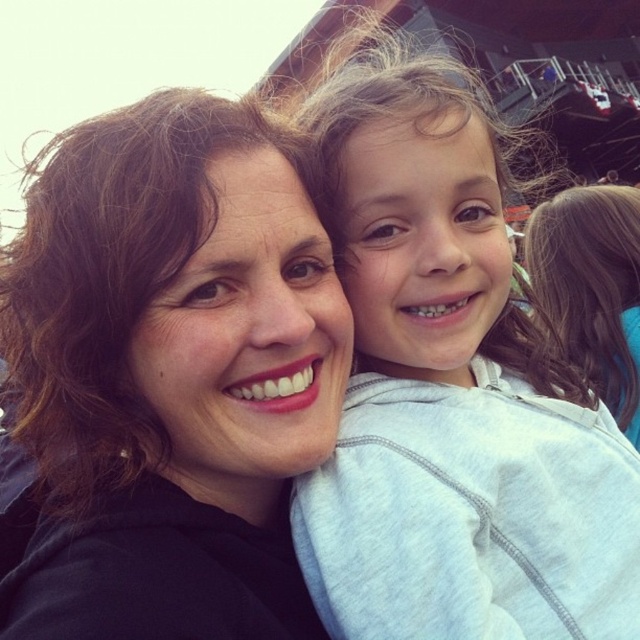
Which of these two, matte black hoodie at center or gray cotton hoodie at upper right, stands shorter?

matte black hoodie at center is shorter.

Which of these two, matte black hoodie at center or gray cotton hoodie at upper right, stands taller?

With more height is gray cotton hoodie at upper right.

Identify the location of matte black hoodie at center. (164, 378).

Locate an element on the screen. The image size is (640, 640). matte black hoodie at center is located at coordinates (164, 378).